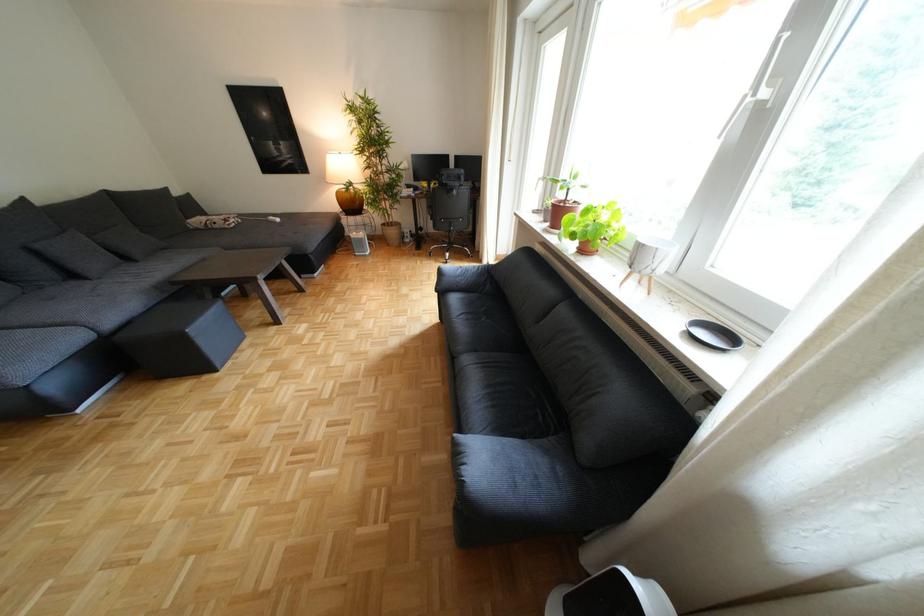
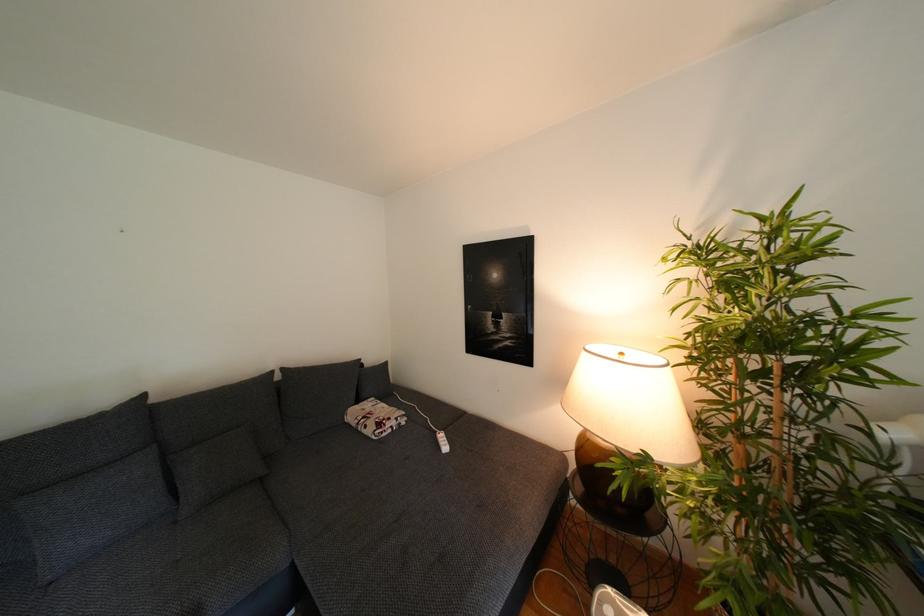
The point at (228, 227) is marked in the first image. Where is the corresponding point in the second image?

(378, 431)